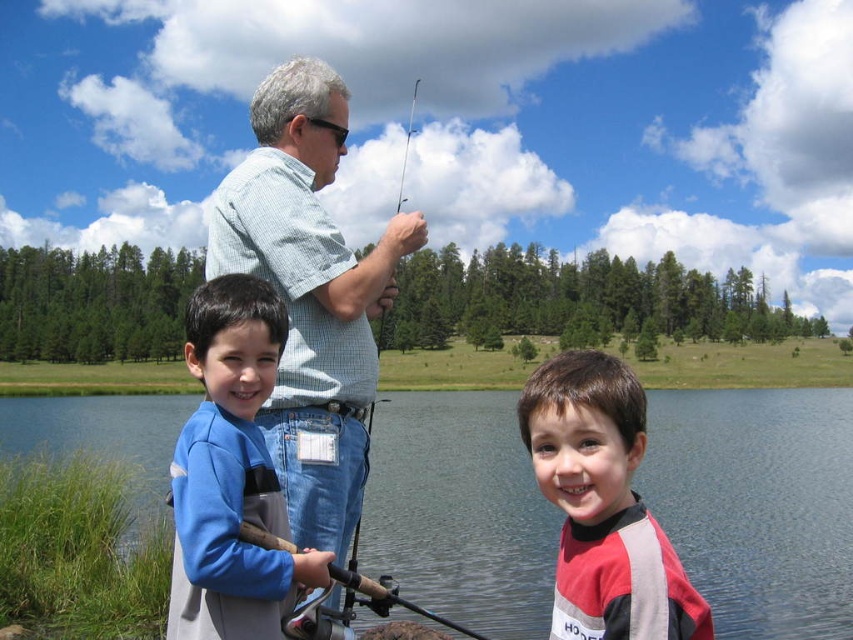
Who is taller, blue fleece jacket at left or red and gray wetsuit at center?

With more height is red and gray wetsuit at center.

The image size is (853, 640). I want to click on blue fleece jacket at left, so click(x=231, y=474).

Does point (242, 300) come farther from viewer compared to point (590, 444)?

That is True.

The height and width of the screenshot is (640, 853). I want to click on blue fleece jacket at left, so click(x=231, y=474).

This screenshot has height=640, width=853. What do you see at coordinates (310, 294) in the screenshot? I see `light blue checkered shirt at center` at bounding box center [310, 294].

Is point (285, 129) behind point (674, 624)?

Yes.

The image size is (853, 640). Find the location of `light blue checkered shirt at center`. light blue checkered shirt at center is located at coordinates (310, 294).

Can you confirm if blue water at center is positioned to the right of blue fleece jacket at left?

Correct, you'll find blue water at center to the right of blue fleece jacket at left.

Locate an element on the screen. blue water at center is located at coordinates (758, 504).

Which is behind, point (3, 440) or point (316, 566)?

Positioned behind is point (3, 440).

Locate an element on the screen. blue water at center is located at coordinates (758, 504).